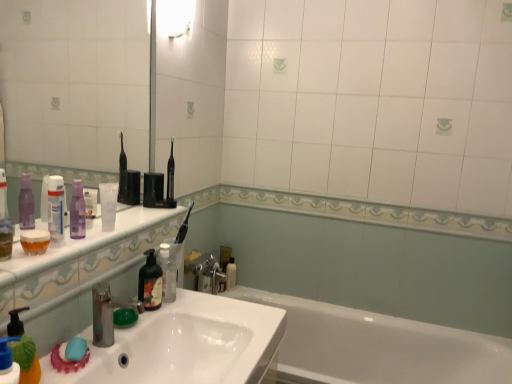
The image size is (512, 384). I want to click on free point in front of white matte tube at center, arranged as the second mouthwash when viewed from the right, so click(81, 244).